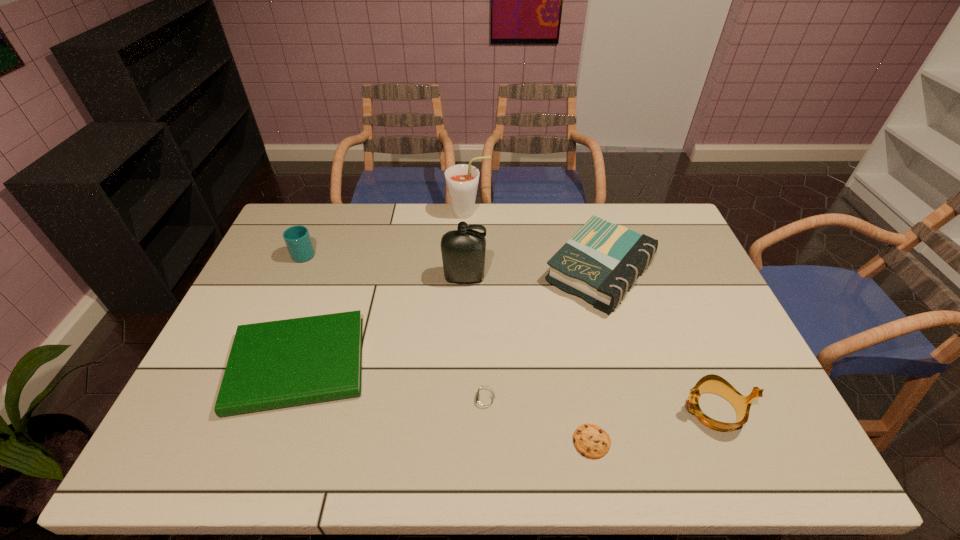
Identify the location of paperback book that is at the left edge. This screenshot has width=960, height=540. (285, 363).

Identify the location of paperback book located in the right edge section of the desktop. This screenshot has height=540, width=960. (599, 263).

Find the location of a particular element. tiara situated at the right edge is located at coordinates (711, 383).

The width and height of the screenshot is (960, 540). In order to click on object at the far left corner in this screenshot , I will do `click(297, 238)`.

Image resolution: width=960 pixels, height=540 pixels. What are the coordinates of `object that is at the far right corner` in the screenshot? It's located at (599, 263).

Where is `object positioned at the near right corner`? The width and height of the screenshot is (960, 540). object positioned at the near right corner is located at coordinates (711, 383).

This screenshot has height=540, width=960. Identify the location of vacant space at the far edge. (504, 228).

Where is `free point at the near edge`? Image resolution: width=960 pixels, height=540 pixels. free point at the near edge is located at coordinates (712, 452).

You are a GUI agent. You are given a task and a screenshot of the screen. Output one action in this format:
    pyautogui.click(x=<x>, y=<y>)
    Task: Click on the vacant space at the right edge
    The image size is (960, 540).
    Given the screenshot: What is the action you would take?
    pyautogui.click(x=762, y=411)

In order to click on vacant space in between the bottle and the nearer paperback book in this screenshot , I will do `click(381, 321)`.